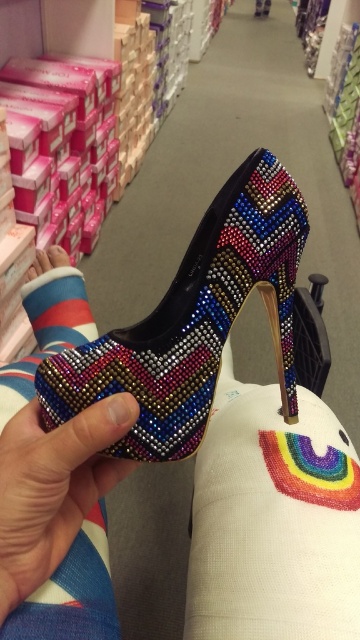
Is multicolored beaded shoe at center above striped cotton sock at lower left?

No, multicolored beaded shoe at center is not above striped cotton sock at lower left.

Is multicolored beaded shoe at center positioned behind striped cotton sock at lower left?

That is False.

What do you see at coordinates (195, 321) in the screenshot? The image size is (360, 640). I see `multicolored beaded shoe at center` at bounding box center [195, 321].

I want to click on multicolored beaded shoe at center, so click(195, 321).